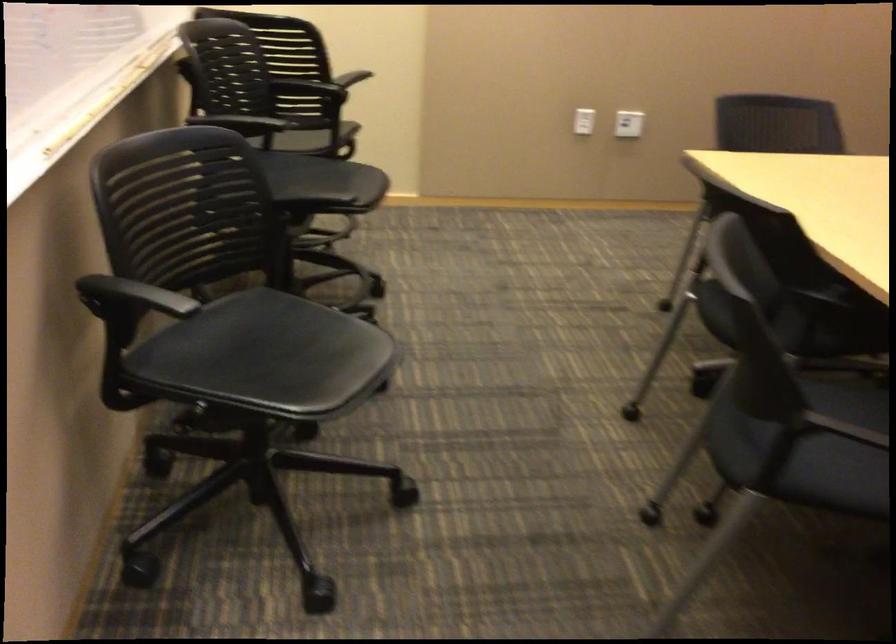
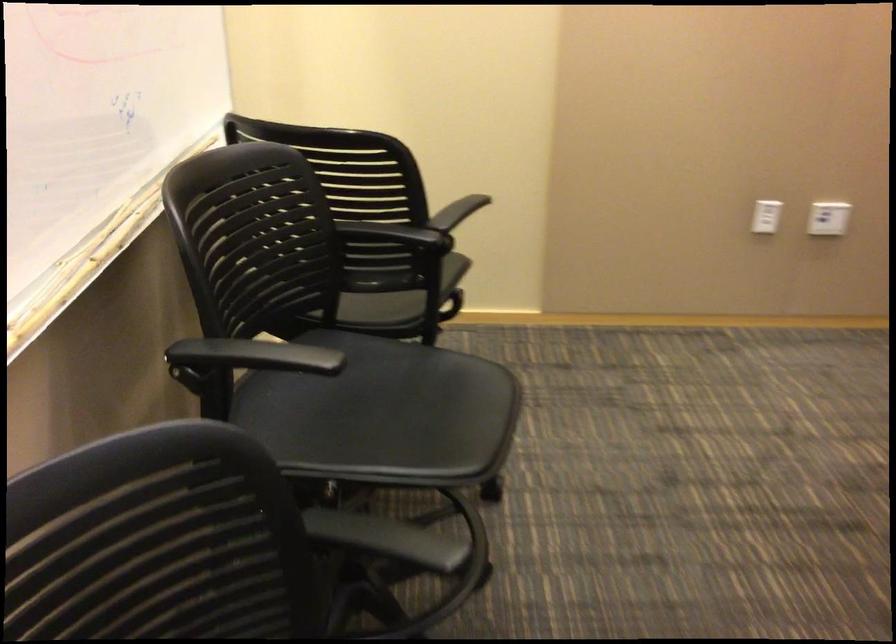
Question: The camera is either moving clockwise (left) or counter-clockwise (right) around the object. The first image is from the beginning of the video and the second image is from the end. Is the camera moving left or right when shooting the video?

Choices:
 (A) Left
 (B) Right

Answer: (B)